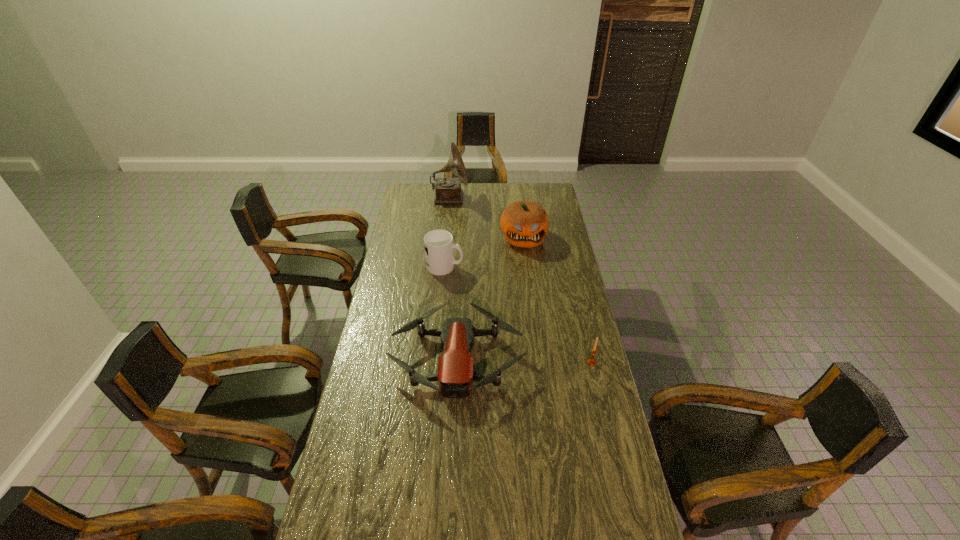
This screenshot has width=960, height=540. I want to click on free space at the right edge of the desktop, so click(x=572, y=284).

I want to click on free space at the far left corner of the desktop, so click(x=419, y=187).

Image resolution: width=960 pixels, height=540 pixels. I want to click on free space that is in between the shortest object and the pumpkin, so click(491, 298).

At what (x,y) coordinates should I click in order to perform the action: click on free area in between the shortest object and the third farthest object. Please return your answer as a coordinate pair (x, y). Image resolution: width=960 pixels, height=540 pixels. Looking at the image, I should click on (451, 313).

The width and height of the screenshot is (960, 540). Find the location of `vacant region between the candle_holder and the drone`. vacant region between the candle_holder and the drone is located at coordinates (524, 361).

This screenshot has width=960, height=540. What are the coordinates of `free space between the mug and the shortest object` in the screenshot? It's located at (451, 313).

Select which object appears as the fourth closest to the rightmost object. Please provide its 2D coordinates. Your answer should be formatted as a tuple, i.e. [(x, y)], where the tuple contains the x and y coordinates of a point satisfying the conditions above.

[(448, 190)]

The image size is (960, 540). Identify the location of object identified as the fourth closest to the rightmost object. tap(448, 190).

The height and width of the screenshot is (540, 960). I want to click on vacant space that satisfies the following two spatial constraints: 1. on the handle side of the mug; 2. on the back side of the second shortest object, so click(437, 362).

This screenshot has width=960, height=540. What are the coordinates of `free space that satisfies the following two spatial constraints: 1. on the face of the pumpkin; 2. on the handle side of the third nearest object` in the screenshot? It's located at (527, 266).